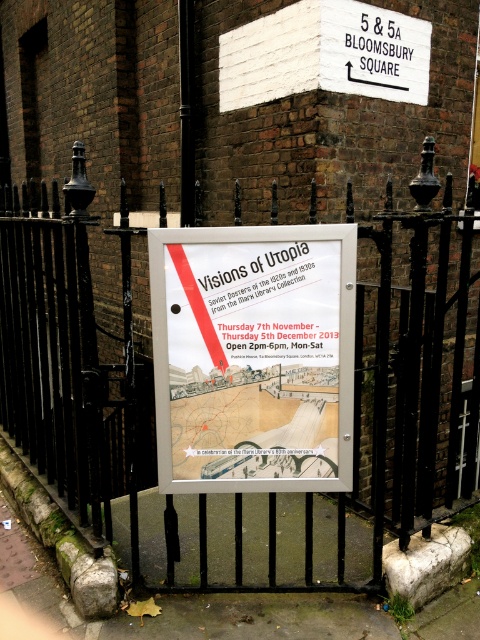
Which is below, black metal fence at center or white paper poster at center?

white paper poster at center is below.

Who is positioned more to the left, black metal fence at center or white paper poster at center?

Positioned to the left is black metal fence at center.

Where is `black metal fence at center`? black metal fence at center is located at coordinates (242, 371).